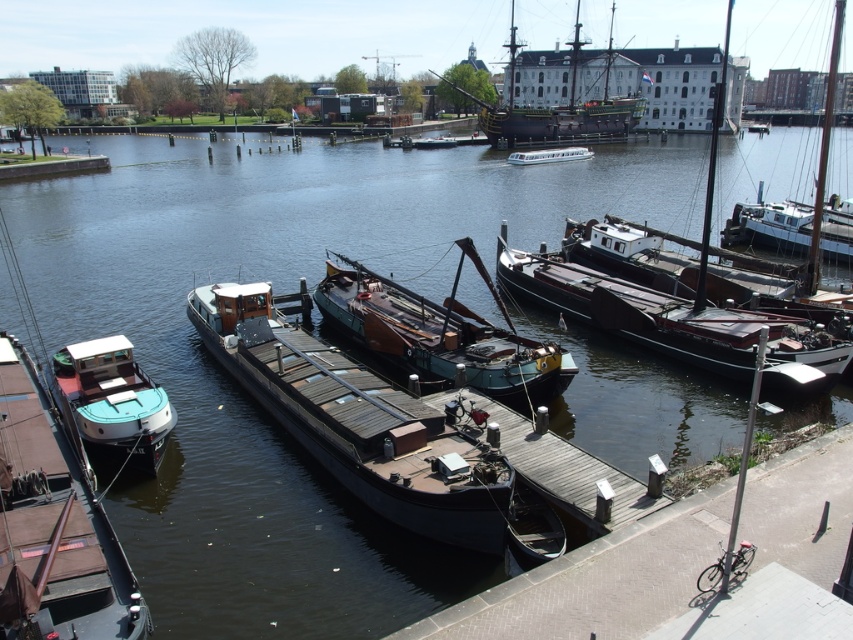
You are a photographer planning to take a photo of the waterfront scene. You want to ensure both the teal wooden boat at center and the white wooden sailboat at right are clearly visible in your shot. Given their positions, which boat will appear closer to the camera in the final image?

The teal wooden boat at center will appear closer to the camera because it is positioned in front of the white wooden sailboat at right.

You are a tourist standing on the dock and want to take a photo of the teal wooden boat at center and the white wooden boat at right. Which boat should you position yourself closer to if you want both boats to appear equally sized in your photo?

You should position yourself closer to the teal wooden boat at center because it is located below the white wooden boat at right, meaning it is farther away from you. By moving closer to the teal wooden boat at center, you can balance their apparent sizes in the photo.

What are the coordinates of the teal wooden boat at center?

The teal wooden boat at center is located at coordinates point (x=440, y=337).